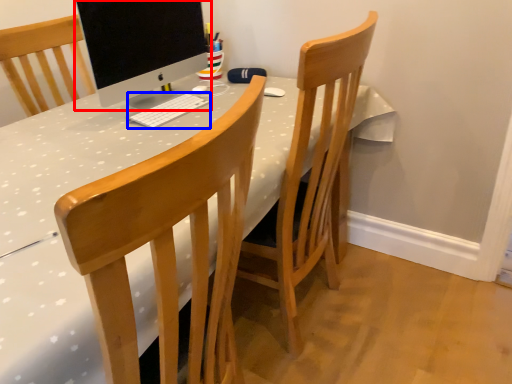
Question: Which object appears farthest to the camera in this image, computer monitor (highlighted by a red box) or computer keyboard (highlighted by a blue box)?

Choices:
 (A) computer monitor
 (B) computer keyboard

Answer: (B)